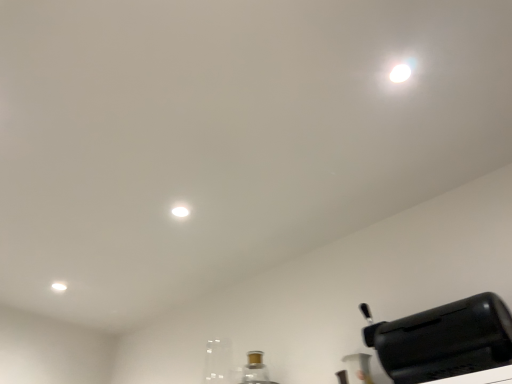
Question: Is matte white light at upper left in contact with black plastic toaster at lower right?

Choices:
 (A) no
 (B) yes

Answer: (A)

Question: Is matte white light at upper left not inside black plastic toaster at lower right?

Choices:
 (A) no
 (B) yes

Answer: (B)

Question: From a real-world perspective, is matte white light at upper left below black plastic toaster at lower right?

Choices:
 (A) no
 (B) yes

Answer: (A)

Question: Considering the relative positions of matte white light at upper left and black plastic toaster at lower right in the image provided, is matte white light at upper left to the right of black plastic toaster at lower right from the viewer's perspective?

Choices:
 (A) no
 (B) yes

Answer: (A)

Question: Can you confirm if matte white light at upper left is shorter than black plastic toaster at lower right?

Choices:
 (A) no
 (B) yes

Answer: (B)

Question: From a real-world perspective, is matte white light at upper left over black plastic toaster at lower right?

Choices:
 (A) yes
 (B) no

Answer: (A)

Question: Is black plastic toaster at lower right completely or partially outside of matte white light at upper left?

Choices:
 (A) yes
 (B) no

Answer: (A)

Question: Are black plastic toaster at lower right and matte white light at upper left far apart?

Choices:
 (A) no
 (B) yes

Answer: (B)

Question: Could matte white light at upper left be considered to be inside black plastic toaster at lower right?

Choices:
 (A) yes
 (B) no

Answer: (B)

Question: Is black plastic toaster at lower right facing away from matte white light at upper left?

Choices:
 (A) yes
 (B) no

Answer: (B)

Question: From a real-world perspective, is black plastic toaster at lower right physically above matte white light at upper left?

Choices:
 (A) yes
 (B) no

Answer: (B)

Question: Can you confirm if black plastic toaster at lower right is taller than matte white light at upper left?

Choices:
 (A) yes
 (B) no

Answer: (A)

Question: Considering the positions of black plastic toaster at lower right and matte white light at upper left in the image, is black plastic toaster at lower right bigger or smaller than matte white light at upper left?

Choices:
 (A) big
 (B) small

Answer: (A)